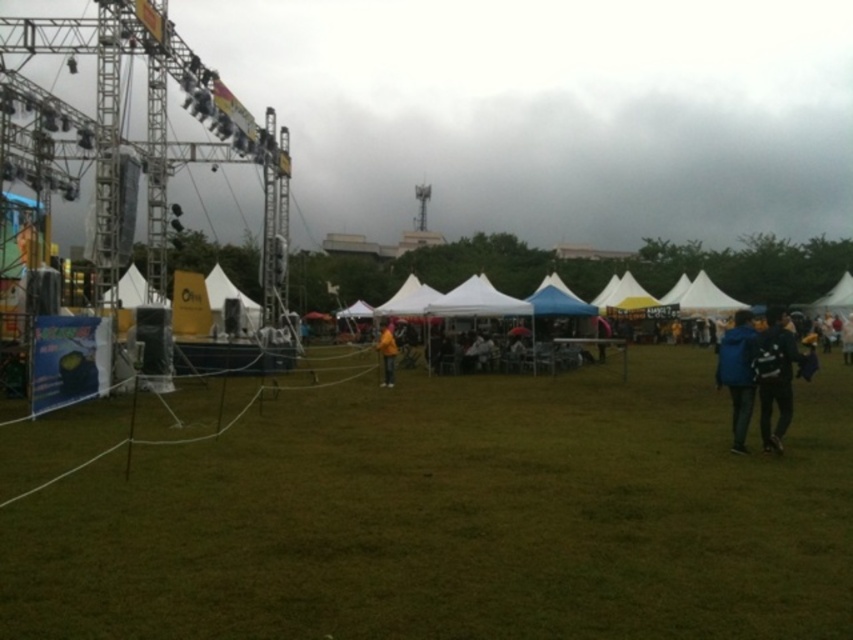
Does point (769, 444) come closer to viewer compared to point (846, 324)?

Yes.

Does blue fabric backpack at right appear over light blue fabric tent at center?

Actually, blue fabric backpack at right is below light blue fabric tent at center.

Does point (791, 403) come farther from viewer compared to point (850, 321)?

No.

The height and width of the screenshot is (640, 853). Identify the location of blue fabric backpack at right. (775, 376).

Does green grass at center appear on the left side of yellow matte jacket at center?

Incorrect, green grass at center is not on the left side of yellow matte jacket at center.

Does green grass at center have a greater height compared to yellow matte jacket at center?

Incorrect, green grass at center's height is not larger of yellow matte jacket at center's.

The width and height of the screenshot is (853, 640). What do you see at coordinates (457, 516) in the screenshot?
I see `green grass at center` at bounding box center [457, 516].

The image size is (853, 640). What are the coordinates of `green grass at center` in the screenshot? It's located at (457, 516).

Between point (389, 369) and point (848, 339), which one is positioned behind?

Point (848, 339)

Who is higher up, yellow matte jacket at center or light blue fabric tent at center?

light blue fabric tent at center is higher up.

Which is in front, point (384, 376) or point (842, 344)?

Point (384, 376) is in front.

Where is `yellow matte jacket at center`? yellow matte jacket at center is located at coordinates (387, 355).